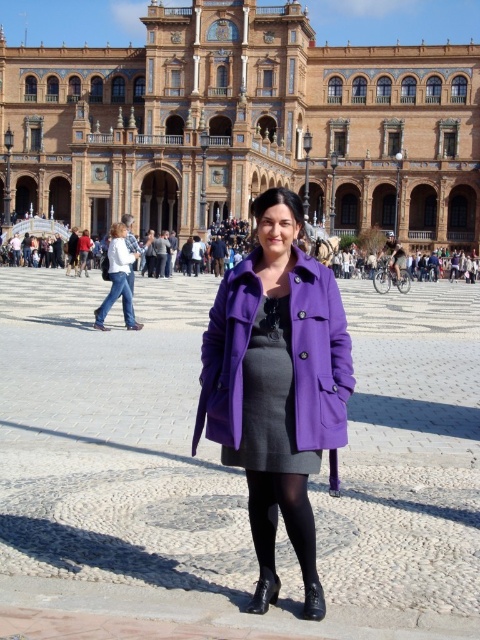
Between matte brown building at center and matte gray dress at center, which one has more height?

With more height is matte brown building at center.

Is matte brown building at center above matte gray dress at center?

Correct, matte brown building at center is located above matte gray dress at center.

Identify the location of matte brown building at center. (243, 125).

Who is more distant from viewer, [292,467] or [311,563]?

Point [292,467]

Between point (277, 340) and point (266, 484), which one is positioned in front?

Point (266, 484) is in front.

Does point (252, 365) come farther from viewer compared to point (262, 493)?

Yes.

Where is `matte gray dress at center`? matte gray dress at center is located at coordinates (269, 397).

Can you confirm if matte brown building at center is shorter than denim jeans at left?

In fact, matte brown building at center may be taller than denim jeans at left.

The width and height of the screenshot is (480, 640). What do you see at coordinates (243, 125) in the screenshot? I see `matte brown building at center` at bounding box center [243, 125].

Identify the location of matte brown building at center. The height and width of the screenshot is (640, 480). (243, 125).